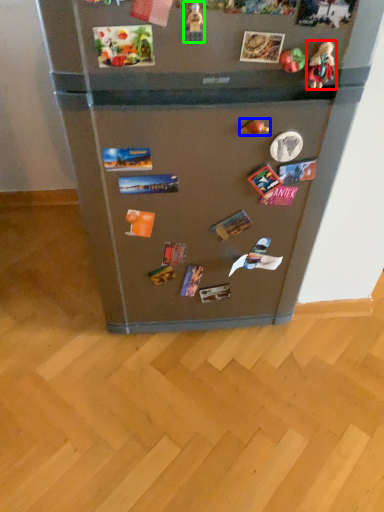
Question: Considering the real-world distances, which object is farthest from toy (highlighted by a red box)? toy (highlighted by a blue box) or toy (highlighted by a green box)?

Choices:
 (A) toy
 (B) toy

Answer: (B)